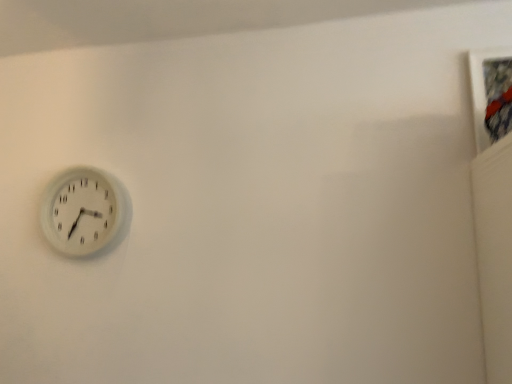
Question: Is white plastic wall clock at left far away from textured fabric picture frame at upper right?

Choices:
 (A) no
 (B) yes

Answer: (B)

Question: Does white plastic wall clock at left come in front of textured fabric picture frame at upper right?

Choices:
 (A) no
 (B) yes

Answer: (A)

Question: Can you confirm if white plastic wall clock at left is taller than textured fabric picture frame at upper right?

Choices:
 (A) yes
 (B) no

Answer: (A)

Question: Can you confirm if white plastic wall clock at left is positioned to the right of textured fabric picture frame at upper right?

Choices:
 (A) no
 (B) yes

Answer: (A)

Question: From a real-world perspective, is white plastic wall clock at left physically above textured fabric picture frame at upper right?

Choices:
 (A) no
 (B) yes

Answer: (A)

Question: Considering the relative sizes of white plastic wall clock at left and textured fabric picture frame at upper right in the image provided, is white plastic wall clock at left bigger than textured fabric picture frame at upper right?

Choices:
 (A) yes
 (B) no

Answer: (A)

Question: Considering the relative positions of textured fabric picture frame at upper right and white plastic wall clock at left in the image provided, is textured fabric picture frame at upper right to the right of white plastic wall clock at left from the viewer's perspective?

Choices:
 (A) yes
 (B) no

Answer: (A)

Question: Is textured fabric picture frame at upper right positioned with its back to white plastic wall clock at left?

Choices:
 (A) no
 (B) yes

Answer: (A)

Question: Can you confirm if textured fabric picture frame at upper right is shorter than white plastic wall clock at left?

Choices:
 (A) yes
 (B) no

Answer: (A)

Question: Is textured fabric picture frame at upper right taller than white plastic wall clock at left?

Choices:
 (A) yes
 (B) no

Answer: (B)

Question: Considering the relative sizes of textured fabric picture frame at upper right and white plastic wall clock at left in the image provided, is textured fabric picture frame at upper right thinner than white plastic wall clock at left?

Choices:
 (A) yes
 (B) no

Answer: (B)

Question: Is textured fabric picture frame at upper right aimed at white plastic wall clock at left?

Choices:
 (A) yes
 (B) no

Answer: (B)

Question: In the image, is textured fabric picture frame at upper right positioned in front of or behind white plastic wall clock at left?

Choices:
 (A) front
 (B) behind

Answer: (A)